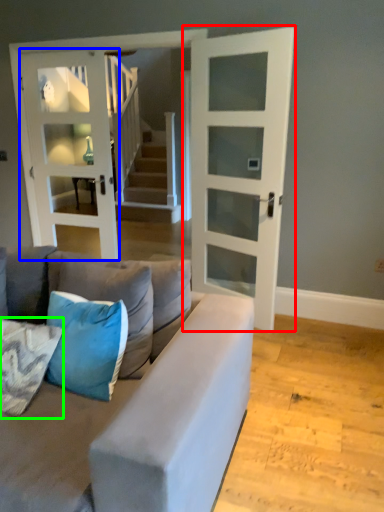
Question: Considering the real-world distances, which object is closest to door (highlighted by a red box)? door (highlighted by a blue box) or pillow (highlighted by a green box).

Choices:
 (A) door
 (B) pillow

Answer: (A)